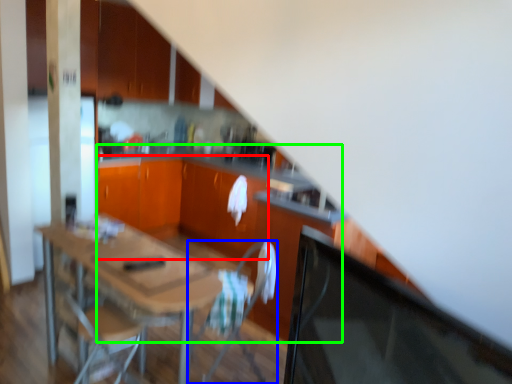
Question: Which object is positioned farthest from cabinetry (highlighted by a red box)? Select from chair (highlighted by a blue box) and computer desk (highlighted by a green box).

Choices:
 (A) chair
 (B) computer desk

Answer: (A)